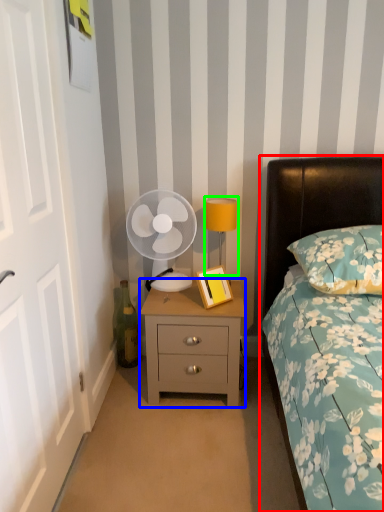
Question: Which is nearer to the bed (highlighted by a red box)? nightstand (highlighted by a blue box) or bedside lamp (highlighted by a green box).

Choices:
 (A) nightstand
 (B) bedside lamp

Answer: (B)